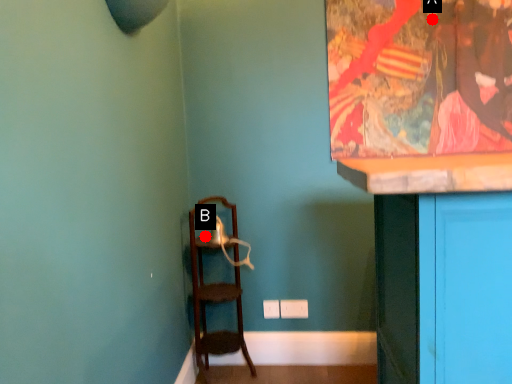
Question: Two points are circled on the image, labeled by A and B beside each circle. Which point is further to the camera?

Choices:
 (A) A is further
 (B) B is further

Answer: (B)